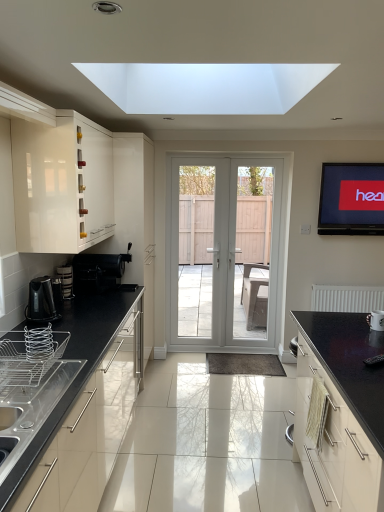
Question: From a real-world perspective, is white glossy door at center physically below matte black tv at upper right?

Choices:
 (A) yes
 (B) no

Answer: (A)

Question: From a real-world perspective, is white glossy door at center over matte black tv at upper right?

Choices:
 (A) yes
 (B) no

Answer: (B)

Question: Would you say white glossy door at center is outside matte black tv at upper right?

Choices:
 (A) no
 (B) yes

Answer: (B)

Question: Considering the relative sizes of white glossy door at center and matte black tv at upper right in the image provided, is white glossy door at center bigger than matte black tv at upper right?

Choices:
 (A) yes
 (B) no

Answer: (A)

Question: Is white glossy door at center looking in the opposite direction of matte black tv at upper right?

Choices:
 (A) no
 (B) yes

Answer: (A)

Question: Considering their positions, is glossy black countertop at right, acting as the 1th cabinetry starting from the right, located in front of or behind white glossy door at center?

Choices:
 (A) front
 (B) behind

Answer: (A)

Question: Is glossy black countertop at right, placed as the second cabinetry when sorted from left to right, bigger or smaller than white glossy door at center?

Choices:
 (A) big
 (B) small

Answer: (A)

Question: Which is correct: glossy black countertop at right, acting as the 1th cabinetry starting from the right, is inside white glossy door at center, or outside of it?

Choices:
 (A) inside
 (B) outside

Answer: (B)

Question: Considering the positions of glossy black countertop at right, placed as the second cabinetry when sorted from top to bottom, and white glossy door at center in the image, is glossy black countertop at right, placed as the second cabinetry when sorted from top to bottom, wider or thinner than white glossy door at center?

Choices:
 (A) wide
 (B) thin

Answer: (A)

Question: In the image, is white glossy mug at lower right, the 2th appliance viewed from the front, on the left side or the right side of white matte radiator at right?

Choices:
 (A) right
 (B) left

Answer: (B)

Question: Is white glossy mug at lower right, the 2th appliance viewed from the front, wider or thinner than white matte radiator at right?

Choices:
 (A) thin
 (B) wide

Answer: (B)

Question: Is point (375, 328) closer or farther from the camera than point (337, 305)?

Choices:
 (A) farther
 (B) closer

Answer: (B)

Question: Which is correct: white glossy mug at lower right, which is the second appliance from back to front, is inside white matte radiator at right, or outside of it?

Choices:
 (A) inside
 (B) outside

Answer: (B)

Question: Is silver metallic wire basket at lower left, which is the 2th appliance in right-to-left order, wider or thinner than glossy black countertop at right, placed as the second cabinetry when sorted from top to bottom?

Choices:
 (A) wide
 (B) thin

Answer: (B)

Question: From a real-world perspective, relative to glossy black countertop at right, placed as the second cabinetry when sorted from top to bottom, is silver metallic wire basket at lower left, which appears as the first appliance when viewed from the front, vertically above or below?

Choices:
 (A) above
 (B) below

Answer: (A)